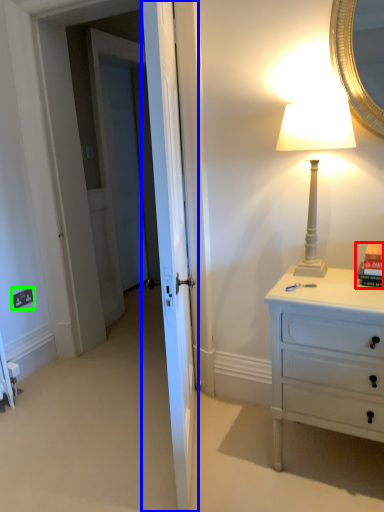
Question: Which object is the farthest from book (highlighted by a red box)? Choose among these: door (highlighted by a blue box) or electric outlet (highlighted by a green box).

Choices:
 (A) door
 (B) electric outlet

Answer: (B)